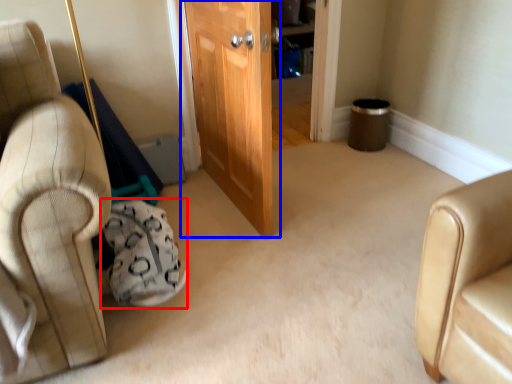
Question: Which point is further to the camera, bean bag chair (highlighted by a red box) or door (highlighted by a blue box)?

Choices:
 (A) bean bag chair
 (B) door

Answer: (B)